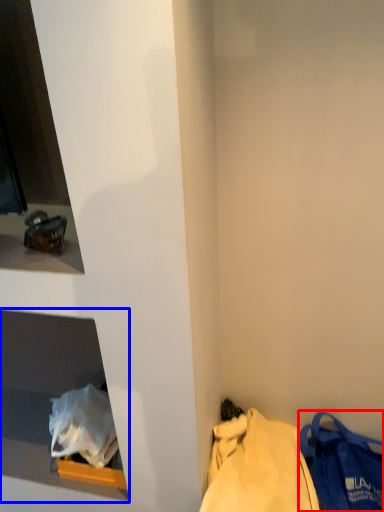
Question: Which object appears farthest to the camera in this image, handbag (highlighted by a red box) or cabinet (highlighted by a blue box)?

Choices:
 (A) handbag
 (B) cabinet

Answer: (B)